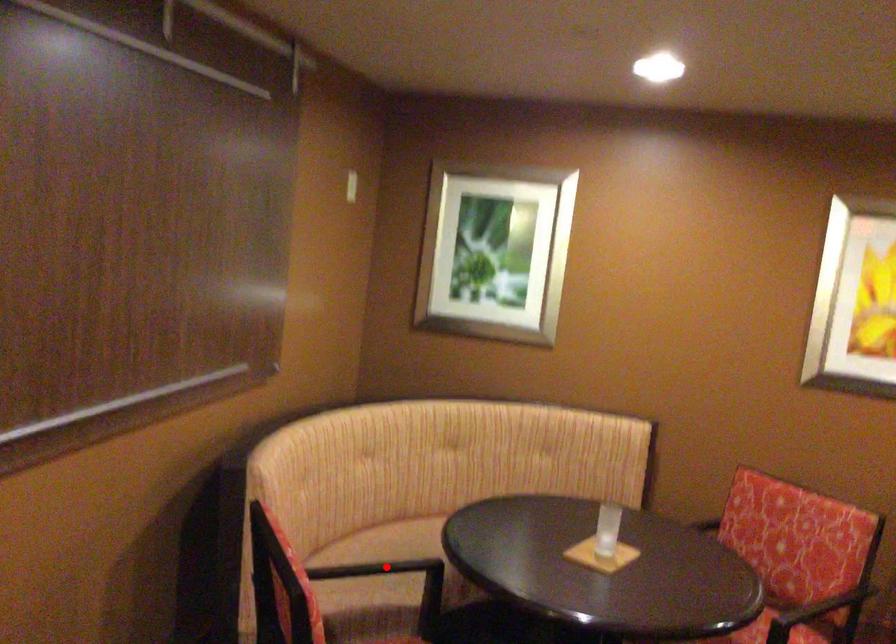
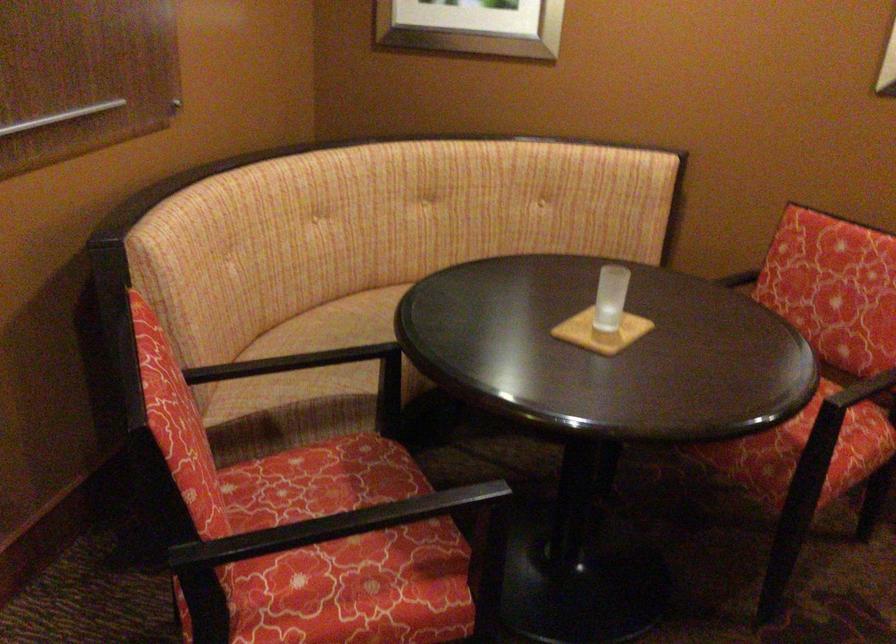
Find the pixel in the second image that matches the highlighted location in the first image.

(337, 343)